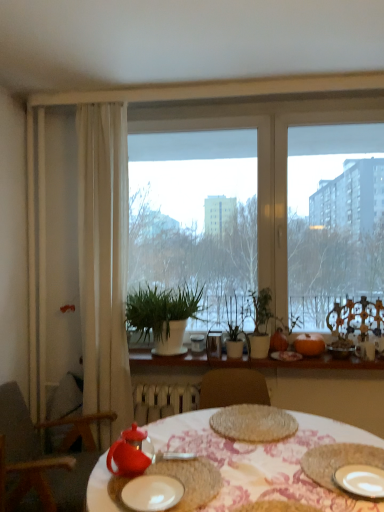
The height and width of the screenshot is (512, 384). Identify the location of unoccupied space behind matte red teapot at lower left. (188, 438).